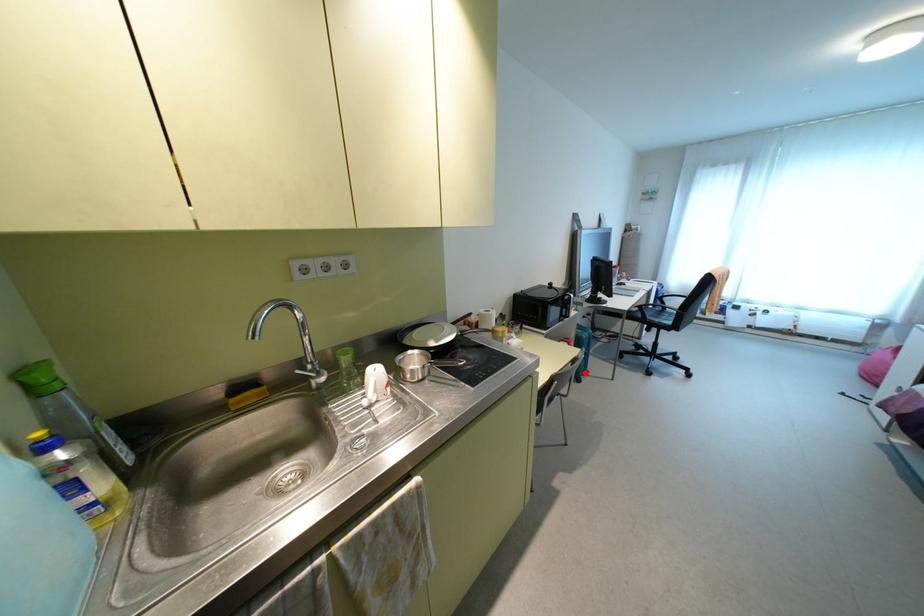
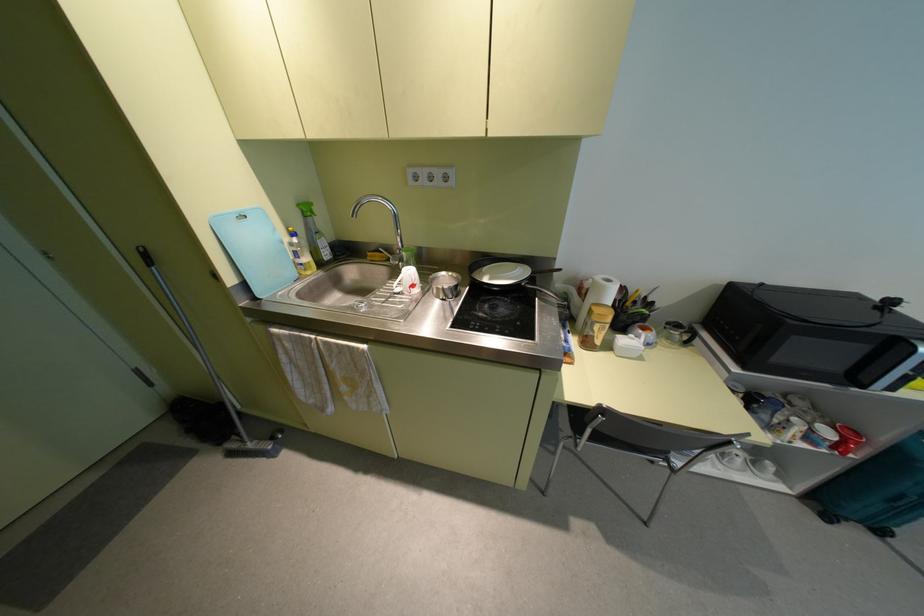
Question: I am providing you with two images of the same scene from different viewpoints. Given a red point in image1, look at the same physical point in image2. Is it:

Choices:
 (A) Closer to the viewpoint
 (B) Farther from the viewpoint

Answer: (A)